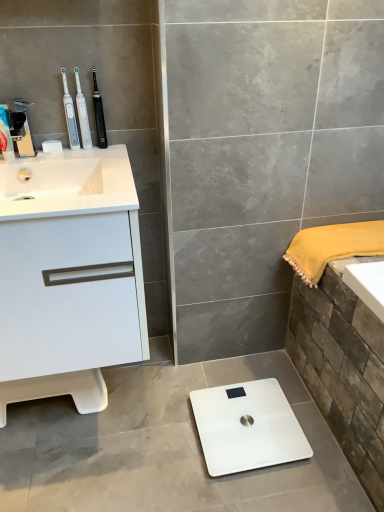
Identify the location of free space above white glossy sink at upper left (from a real-world perspective). (85, 158).